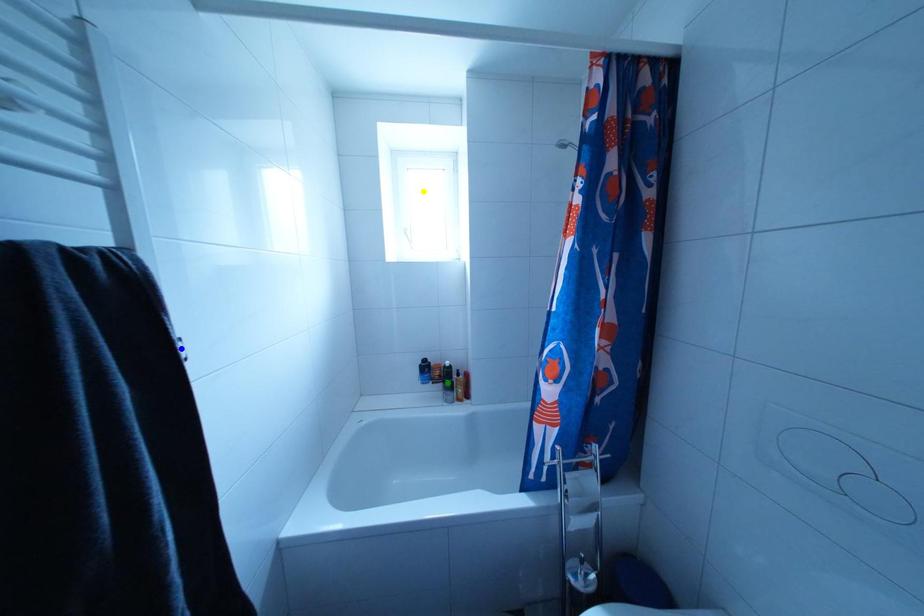
Order these from nearest to farthest:
- yellow point
- blue point
- green point

1. yellow point
2. green point
3. blue point